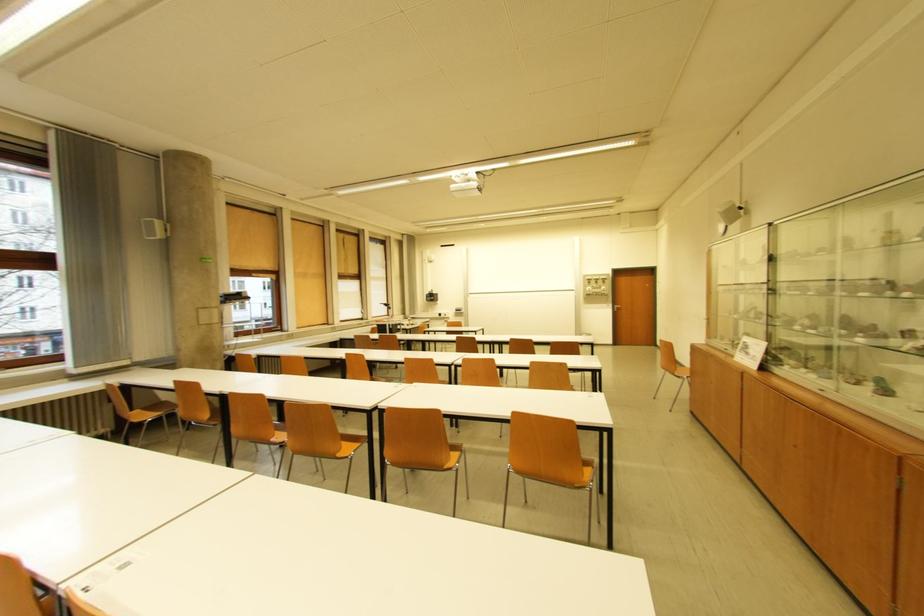
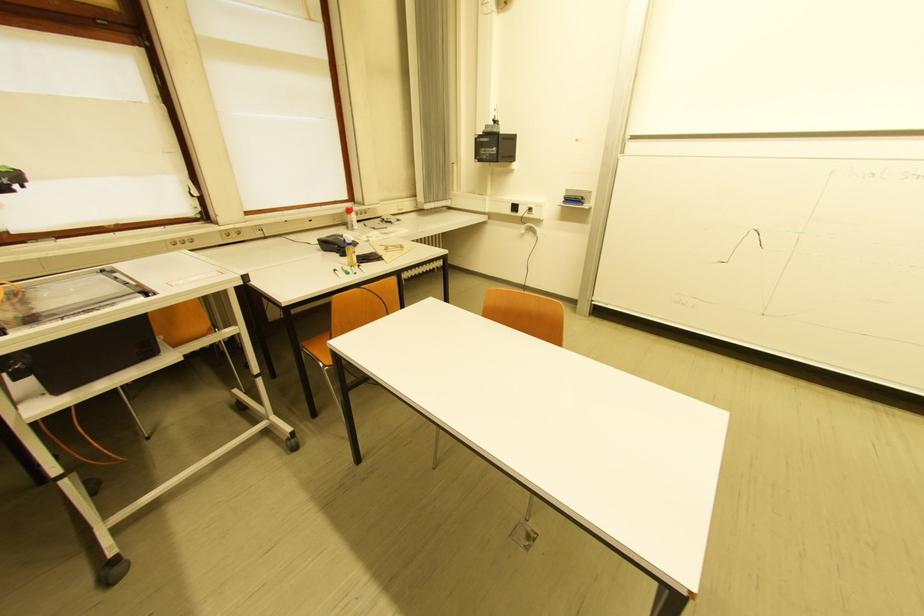
Locate, in the second image, the point that corresponds to point (464, 312) in the first image.

(575, 201)